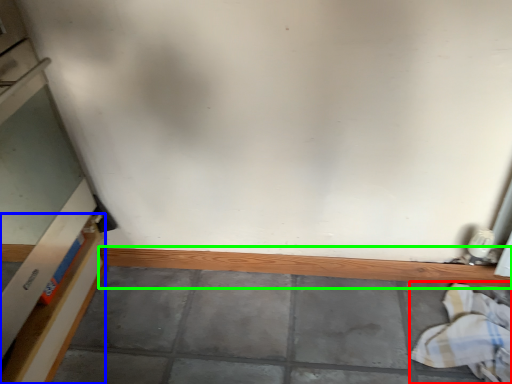
Question: Which object is the farthest from laundry (highlighted by a red box)? Choose among these: shelf (highlighted by a blue box) or ledge (highlighted by a green box).

Choices:
 (A) shelf
 (B) ledge

Answer: (A)